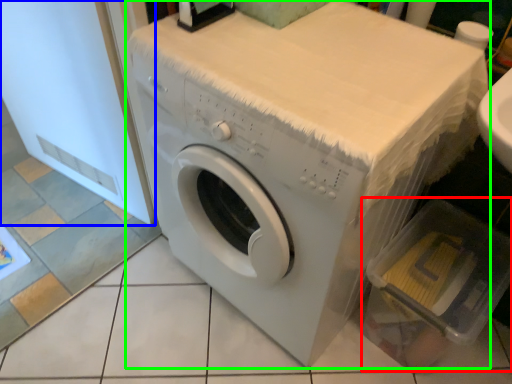
Question: Which is farther away from dish washer (highlighted by a red box)? screen door (highlighted by a blue box) or washing machine (highlighted by a green box)?

Choices:
 (A) screen door
 (B) washing machine

Answer: (A)